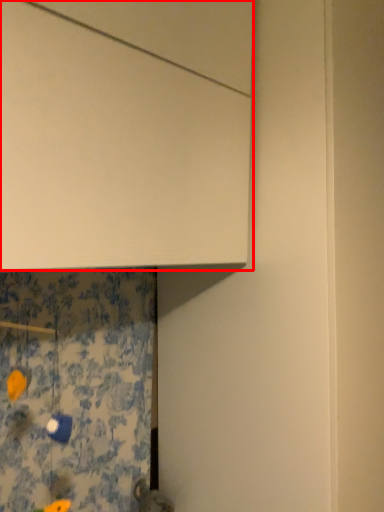
Question: From the image, what is the correct spatial relationship of cabinetry (annotated by the red box) in relation to shower curtain?

Choices:
 (A) left
 (B) right

Answer: (B)